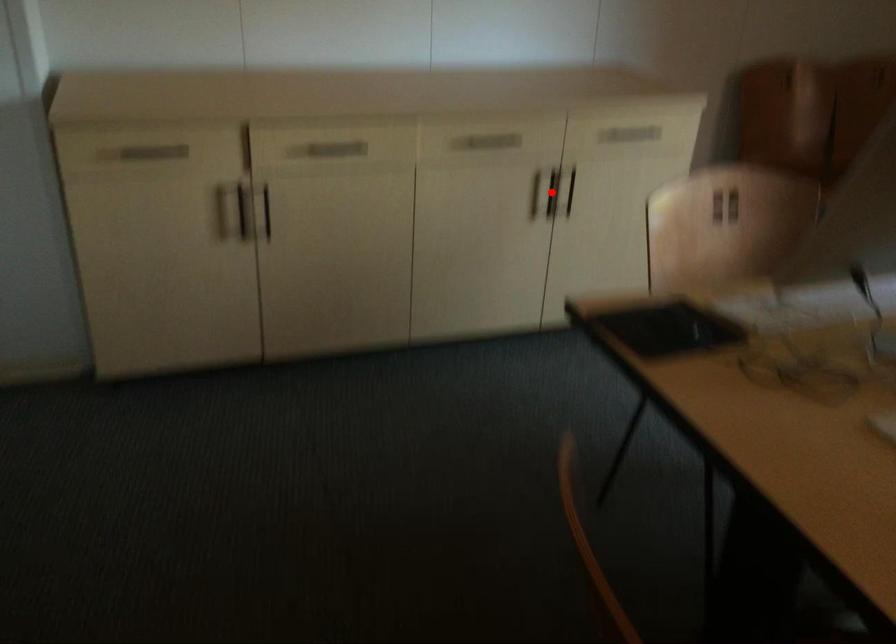
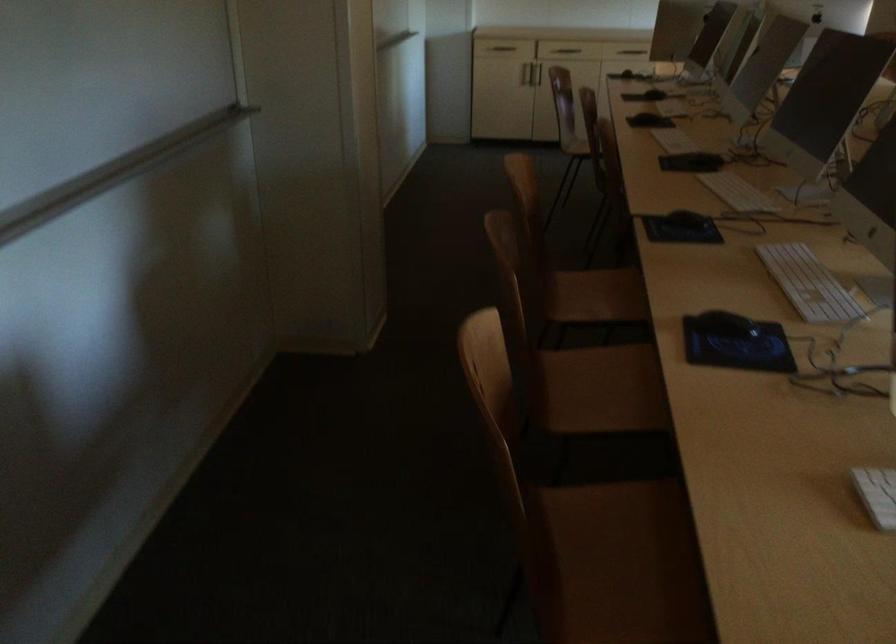
Question: I am providing you with two images of the same scene from different viewpoints. A red point is marked on the first image. At the location where the point appears in image 1, is it still visible in image 2?

Choices:
 (A) Yes
 (B) No

Answer: (B)